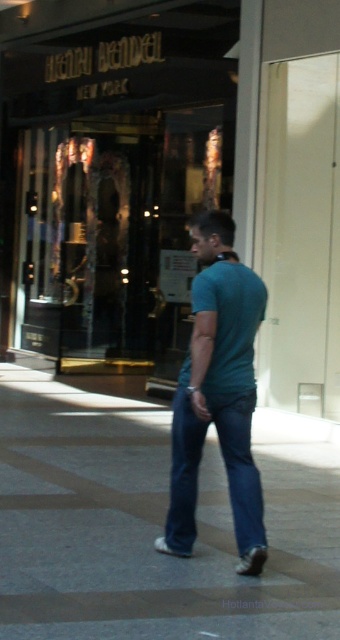
What is located at the coordinates point (x=225, y=467) in the image?

The point (x=225, y=467) marks blue denim jeans at center.

You are standing at the camera position and want to enter the store. Is the glass storefront at center the entrance to the store?

Yes, the glass storefront at center is the entrance to the store as it has doors and the name is displayed above it.